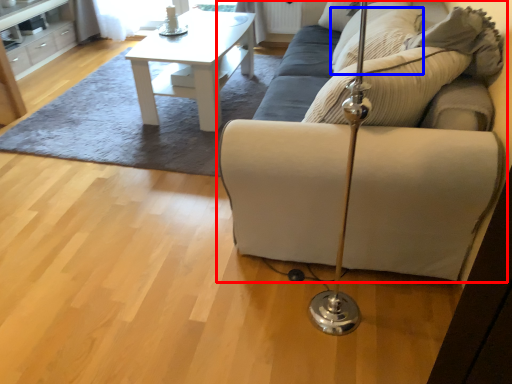
Question: Among these objects, which one is nearest to the camera, studio couch (highlighted by a red box) or pillow (highlighted by a blue box)?

Choices:
 (A) studio couch
 (B) pillow

Answer: (A)